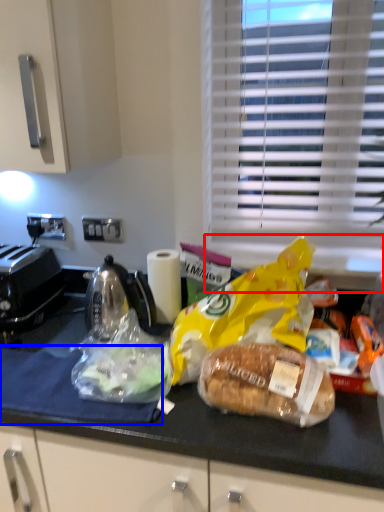
Question: Which object appears closest to the camera in this image, window sill (highlighted by a red box) or cloth (highlighted by a blue box)?

Choices:
 (A) window sill
 (B) cloth

Answer: (B)